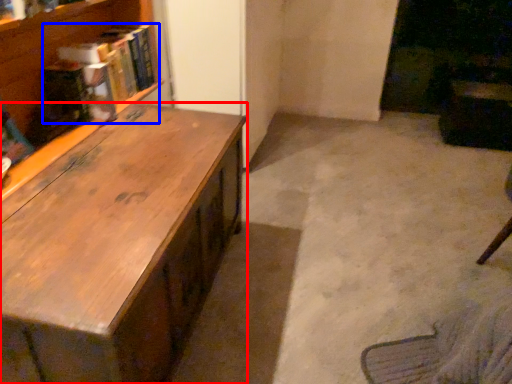
Question: Which object appears farthest to the camera in this image, desk (highlighted by a red box) or book (highlighted by a blue box)?

Choices:
 (A) desk
 (B) book

Answer: (B)